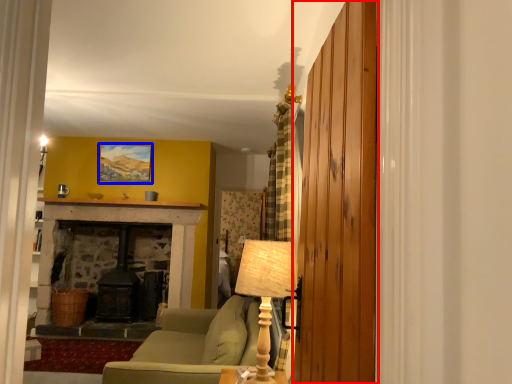
Question: Which object appears closest to the camera in this image, barn door (highlighted by a red box) or picture frame (highlighted by a blue box)?

Choices:
 (A) barn door
 (B) picture frame

Answer: (A)